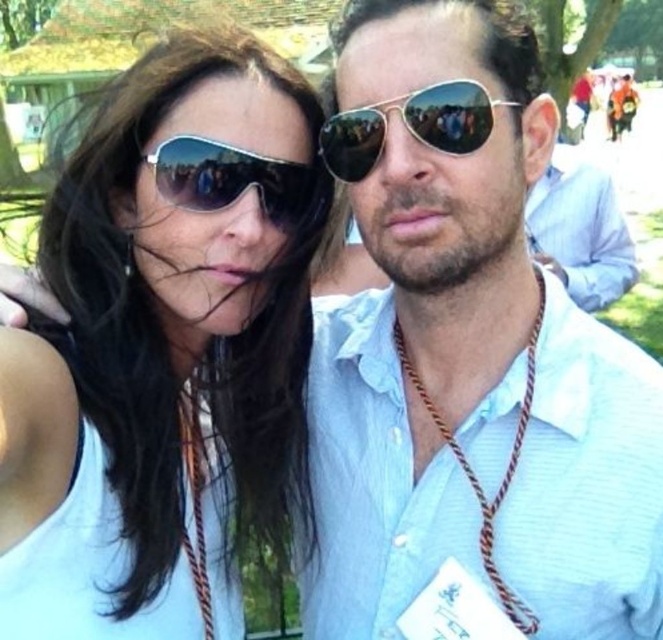
Who is positioned more to the left, matte black sunglasses at upper left or matte black sunglasses at center?

Positioned to the left is matte black sunglasses at upper left.

Which is behind, point (66, 374) or point (196, 152)?

Positioned behind is point (196, 152).

Image resolution: width=663 pixels, height=640 pixels. Find the location of `matte black sunglasses at upper left`. matte black sunglasses at upper left is located at coordinates (164, 349).

Identify the location of matte black sunglasses at upper left. (164, 349).

The height and width of the screenshot is (640, 663). In order to click on matte black sunglasses at upper left in this screenshot , I will do `click(164, 349)`.

Is matte white shirt at center wider than matte black sunglasses at upper left?

Indeed, matte white shirt at center has a greater width compared to matte black sunglasses at upper left.

Is point (357, 168) positioned behind point (278, 163)?

No, (357, 168) is in front of (278, 163).

Describe the element at coordinates (467, 364) in the screenshot. I see `matte white shirt at center` at that location.

You are a GUI agent. You are given a task and a screenshot of the screen. Output one action in this format:
    pyautogui.click(x=<x>, y=<y>)
    Task: Click on the matte white shirt at center
    The image size is (663, 640).
    Given the screenshot: What is the action you would take?
    pyautogui.click(x=467, y=364)